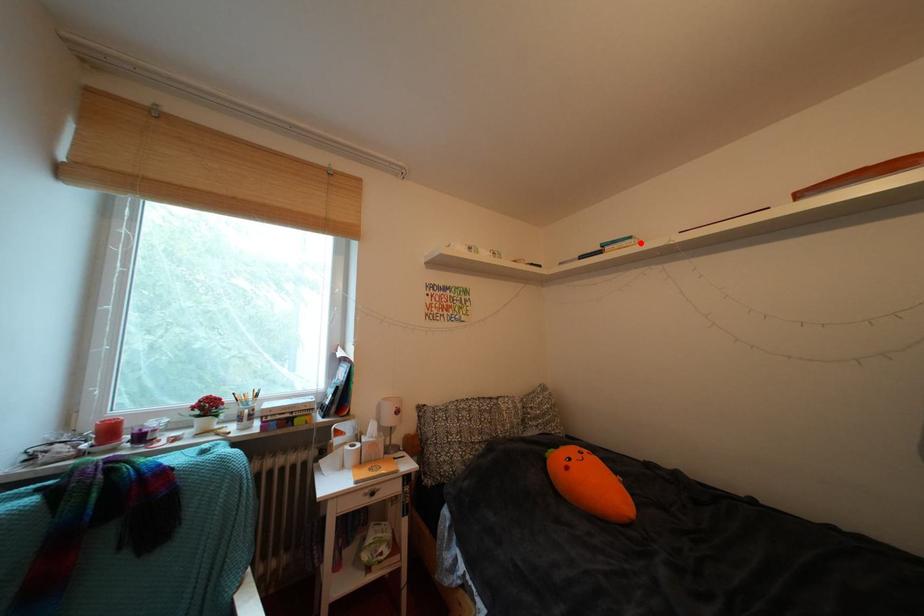
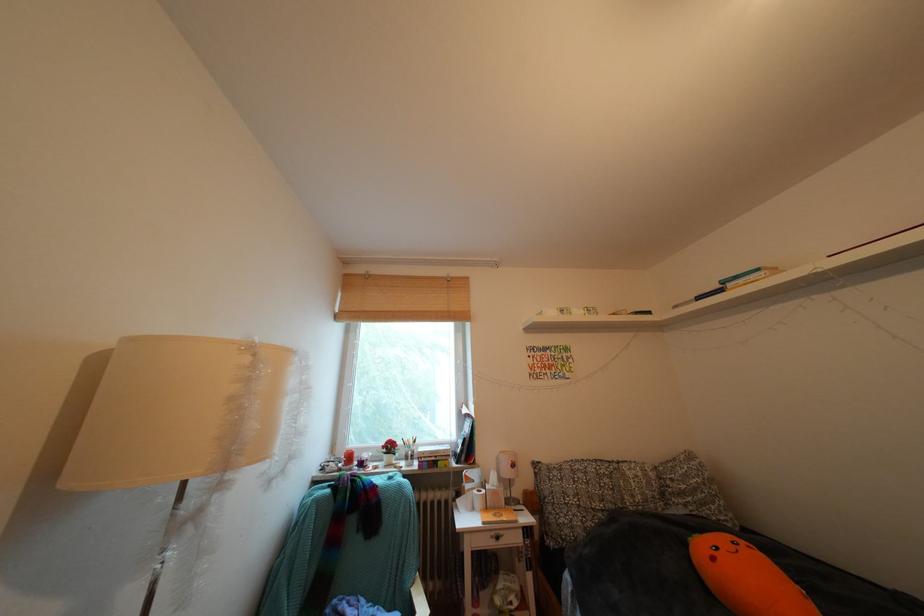
In the second image, find the point that corresponds to the highlighted location in the first image.

(768, 275)